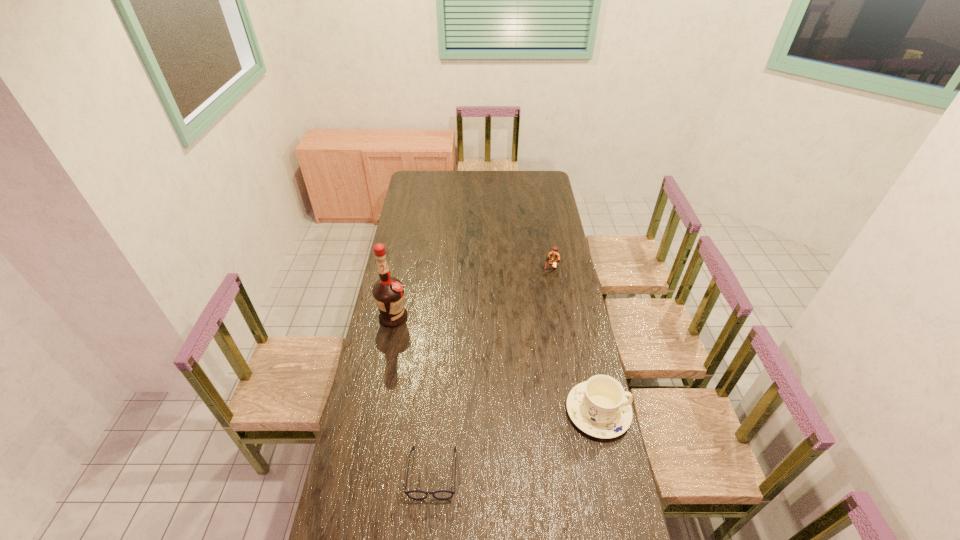
Find the location of a particular element. This screenshot has width=960, height=540. free region at the near right corner of the desktop is located at coordinates (623, 531).

This screenshot has height=540, width=960. I want to click on free spot between the chinaware and the leftmost object, so click(495, 364).

Where is `free space between the shortest object and the chinaware`? The height and width of the screenshot is (540, 960). free space between the shortest object and the chinaware is located at coordinates (516, 442).

Image resolution: width=960 pixels, height=540 pixels. Find the location of `vacant space that is in between the nearest object and the Lego`. vacant space that is in between the nearest object and the Lego is located at coordinates (492, 370).

Where is `free space that is in between the shortest object and the leftmost object`? The image size is (960, 540). free space that is in between the shortest object and the leftmost object is located at coordinates click(413, 395).

Where is `vacant area that lies between the second farthest object and the third farthest object`? The image size is (960, 540). vacant area that lies between the second farthest object and the third farthest object is located at coordinates (495, 364).

This screenshot has height=540, width=960. I want to click on vacant point located between the chinaware and the farthest object, so click(x=574, y=340).

The width and height of the screenshot is (960, 540). I want to click on empty space between the Lego and the second farthest object, so click(x=471, y=293).

Where is `free area in between the Lego and the second object from left to right`? This screenshot has height=540, width=960. free area in between the Lego and the second object from left to right is located at coordinates (492, 370).

The width and height of the screenshot is (960, 540). In order to click on free space between the third object from right to left and the third nearest object in this screenshot , I will do `click(413, 395)`.